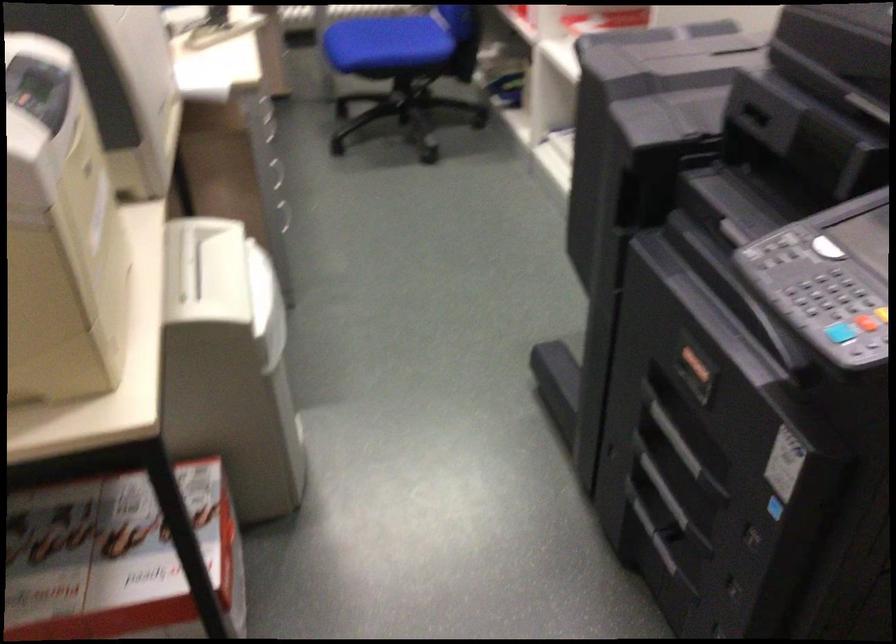
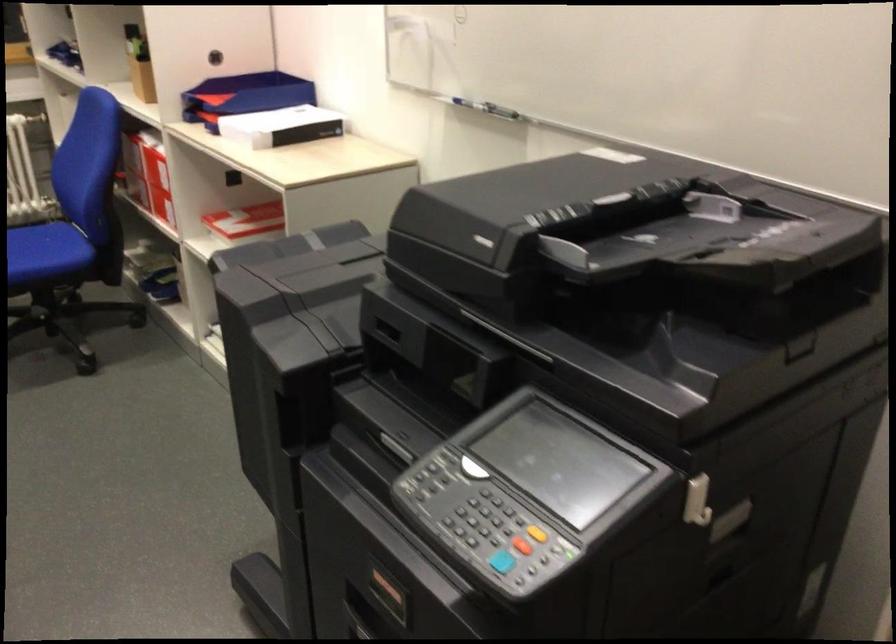
Question: What movement of the cameraman would produce the second image?

Choices:
 (A) Left
 (B) Right
 (C) Forward
 (D) Backward

Answer: (B)